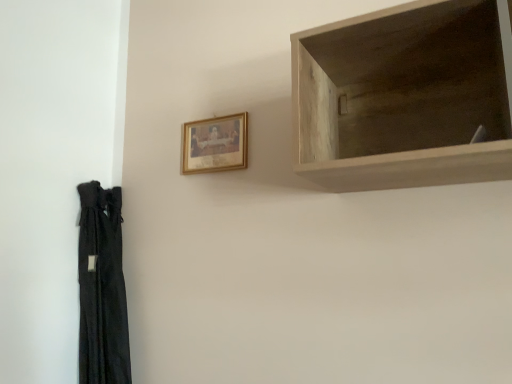
Question: Is light wood shelf at upper right in front of or behind gold-framed picture at upper center in the image?

Choices:
 (A) behind
 (B) front

Answer: (B)

Question: Do you think light wood shelf at upper right is within gold-framed picture at upper center, or outside of it?

Choices:
 (A) outside
 (B) inside

Answer: (A)

Question: From the image's perspective, is light wood shelf at upper right above or below gold-framed picture at upper center?

Choices:
 (A) below
 (B) above

Answer: (B)

Question: From their relative heights in the image, would you say gold-framed picture at upper center is taller or shorter than light wood shelf at upper right?

Choices:
 (A) short
 (B) tall

Answer: (A)

Question: Considering the positions of point (197, 145) and point (492, 129), is point (197, 145) closer or farther from the camera than point (492, 129)?

Choices:
 (A) closer
 (B) farther

Answer: (B)

Question: In the image, is gold-framed picture at upper center positioned in front of or behind light wood shelf at upper right?

Choices:
 (A) front
 (B) behind

Answer: (B)

Question: Considering the positions of gold-framed picture at upper center and light wood shelf at upper right in the image, is gold-framed picture at upper center wider or thinner than light wood shelf at upper right?

Choices:
 (A) thin
 (B) wide

Answer: (A)